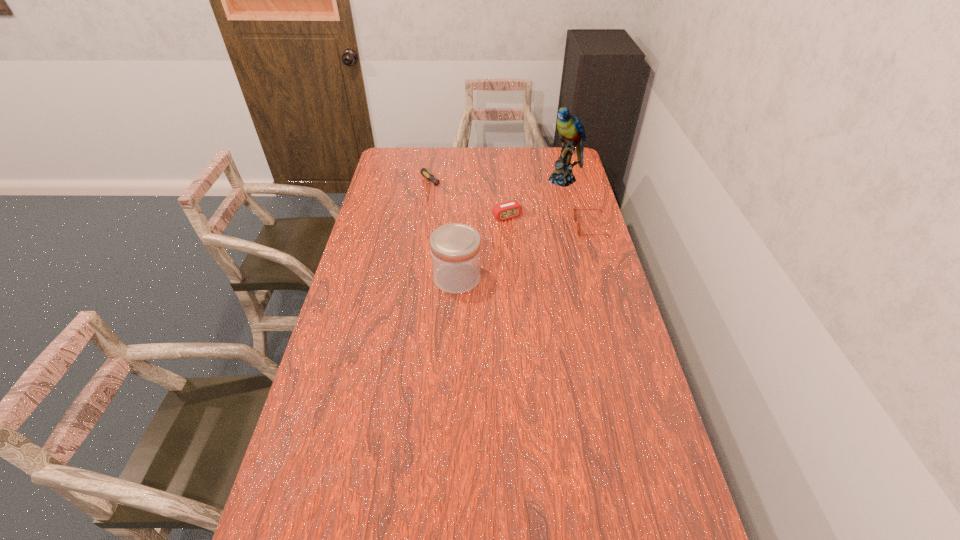
Where is `free region located on the face of the fourth tallest object`? The width and height of the screenshot is (960, 540). free region located on the face of the fourth tallest object is located at coordinates (488, 227).

The height and width of the screenshot is (540, 960). Find the location of `free space located 0.180m insert the shortest object into a screw head`. free space located 0.180m insert the shortest object into a screw head is located at coordinates (467, 215).

Identify the location of vacant space located insert the shortest object into a screw head. (458, 207).

The image size is (960, 540). Find the location of `blank space located 0.320m insert the shortest object into a screw head`. blank space located 0.320m insert the shortest object into a screw head is located at coordinates (487, 233).

The image size is (960, 540). In order to click on vacant region located 0.240m on the front-facing side of the alarm clock in this screenshot , I will do `click(542, 259)`.

The width and height of the screenshot is (960, 540). Find the location of `free space located on the front-facing side of the alarm clock`. free space located on the front-facing side of the alarm clock is located at coordinates (540, 255).

Where is `free space located 0.050m on the front-facing side of the alarm clock`? The height and width of the screenshot is (540, 960). free space located 0.050m on the front-facing side of the alarm clock is located at coordinates (519, 230).

I want to click on vacant space located 0.150m on the face of the tallest object, so click(547, 205).

The width and height of the screenshot is (960, 540). What are the coordinates of `blank area located 0.110m on the face of the tallest object` in the screenshot? It's located at (551, 200).

This screenshot has width=960, height=540. Identify the location of vacant space located 0.140m on the face of the tallest object. (548, 204).